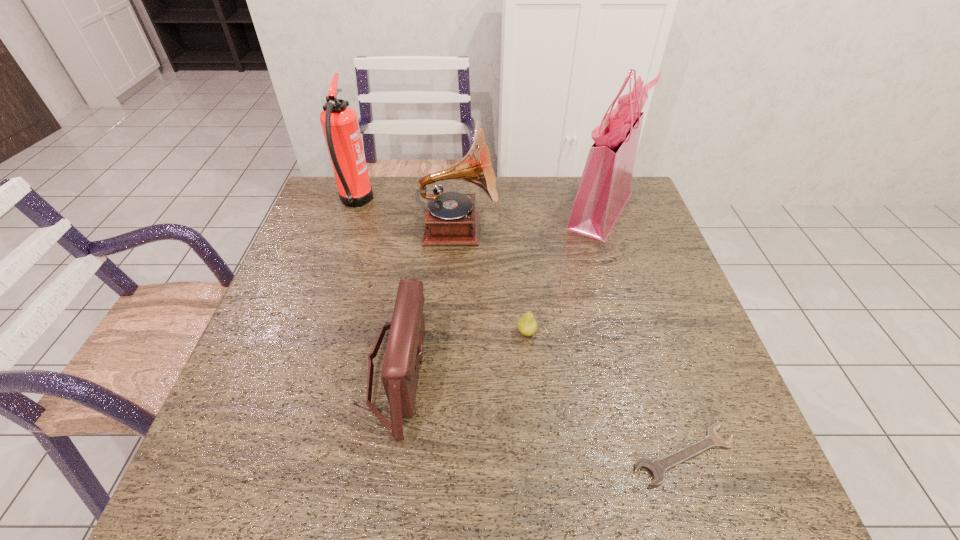
Identify the location of unoccupied position between the shopping bag and the shortest object. This screenshot has width=960, height=540. (642, 333).

Image resolution: width=960 pixels, height=540 pixels. In order to click on empty space between the phonograph_record and the shoulder bag in this screenshot , I will do pos(428,299).

Where is `vacant region between the shopping bag and the leftmost object`? The image size is (960, 540). vacant region between the shopping bag and the leftmost object is located at coordinates (478, 206).

Image resolution: width=960 pixels, height=540 pixels. In order to click on free space that is in between the wrench and the pear in this screenshot , I will do `click(605, 394)`.

You are a GUI agent. You are given a task and a screenshot of the screen. Output one action in this format:
    pyautogui.click(x=<x>, y=<y>)
    Task: Click on the free space between the wrench and the shopping bag
    
    Given the screenshot: What is the action you would take?
    pyautogui.click(x=642, y=333)

In order to click on free space that is in between the wrench and the shopping bag in this screenshot , I will do `click(642, 333)`.

Find the location of a particular element. The width and height of the screenshot is (960, 540). vacant space that's between the second shortest object and the phonograph_record is located at coordinates (492, 281).

This screenshot has width=960, height=540. Identify the location of empty location between the third shortest object and the shortest object. (541, 413).

You are a GUI agent. You are given a task and a screenshot of the screen. Output one action in this format:
    pyautogui.click(x=<x>, y=<y>)
    Task: Click on the object that is the third closest to the third shortest object
    The image size is (960, 540).
    Given the screenshot: What is the action you would take?
    pyautogui.click(x=339, y=122)

At what (x,y) coordinates should I click in order to perform the action: click on object that is the fourth closest one to the shopping bag. Please return your answer as a coordinate pair (x, y). Looking at the image, I should click on (657, 467).